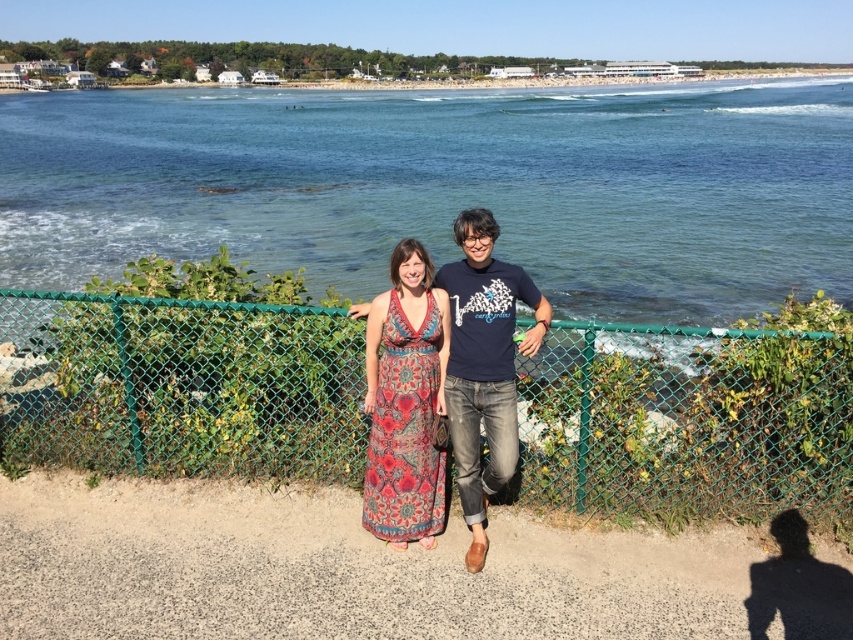
You are a fashion designer observing two dresses in the coastal scene. The dresses are the patterned fabric dress at center and the printed fabric dress at center. Which dress has a bigger size?

The patterned fabric dress at center has a larger size compared to the printed fabric dress at center.

You are a photographer planning to capture a photo of the smooth sand at lower center and the printed fabric dress at center. Based on their positions, which object is located to the left of the other?

The smooth sand at lower center is positioned on the left side of the printed fabric dress at center.

You are a photographer trying to capture both the point at coordinates point (351, 314) and point (437, 358) in the same frame. Since you want both points to be in focus, which point should you focus on first to ensure depth of field covers both?

You should focus on point (351, 314) first because it is closer to the camera than point (437, 358). This ensures the depth of field will cover both points effectively.